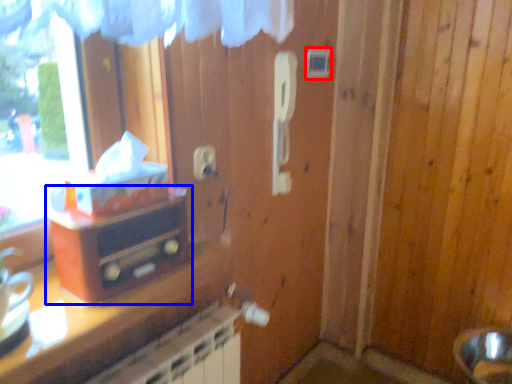
Question: Which object is closer to the camera taking this photo, light switch (highlighted by a red box) or furniture (highlighted by a blue box)?

Choices:
 (A) light switch
 (B) furniture

Answer: (B)